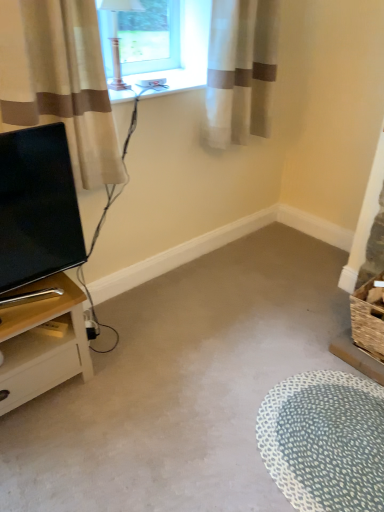
In order to click on vacant region under beige fabric curtain at left, the first curtain from the left (from a real-world perspective) in this screenshot , I will do `click(103, 308)`.